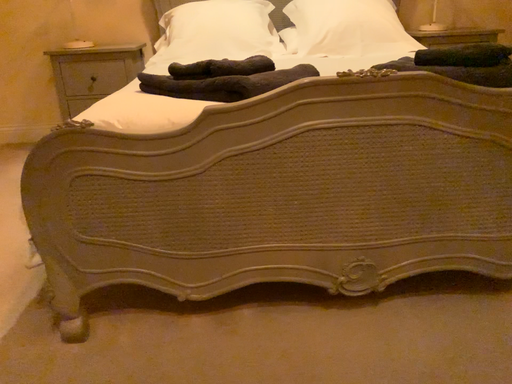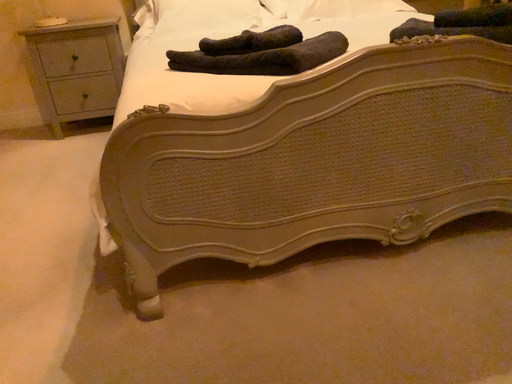
Question: How did the camera likely rotate when shooting the video?

Choices:
 (A) rotated left
 (B) rotated right

Answer: (B)